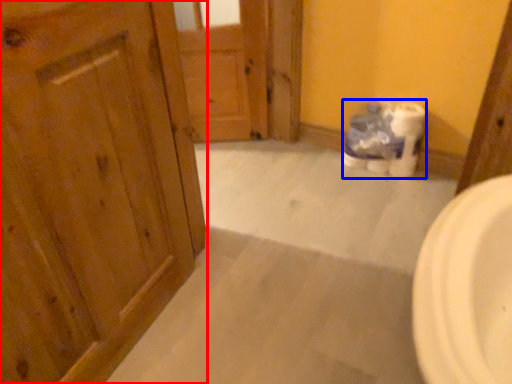
Question: Which point is closer to the camera, door (highlighted by a red box) or toilet paper (highlighted by a blue box)?

Choices:
 (A) door
 (B) toilet paper

Answer: (A)